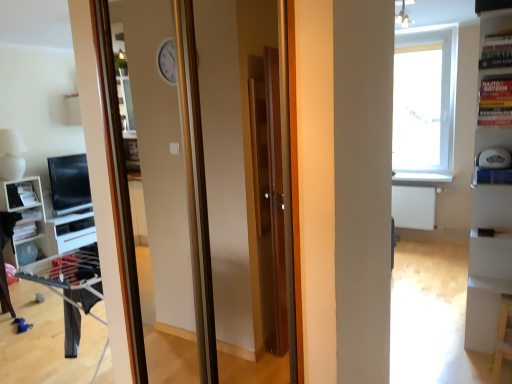
Describe the element at coordinates (488, 259) in the screenshot. The height and width of the screenshot is (384, 512). I see `white glossy bookshelf at right` at that location.

In order to face matte black monitor at left, should I rotate leftwards or rightwards?

Result: A 23.103 degree turn to the left will do.

This screenshot has width=512, height=384. What are the coordinates of `white glossy bookshelf at right` in the screenshot? It's located at (488, 259).

In terms of size, does matte black monitor at left appear bigger or smaller than white glossy shelf at left?

Considering their sizes, matte black monitor at left takes up less space than white glossy shelf at left.

Could you tell me if matte black monitor at left is facing white glossy shelf at left?

No.

Considering the points (55, 213) and (42, 196), which point is behind, point (55, 213) or point (42, 196)?

The point (42, 196) is farther.

Consider the image. Does matte black monitor at left have a lesser height compared to white glossy shelf at left?

Indeed, matte black monitor at left has a lesser height compared to white glossy shelf at left.

Is matte black monitor at left shorter than white glossy bookshelf at right?

Indeed, matte black monitor at left has a lesser height compared to white glossy bookshelf at right.

Can you confirm if matte black monitor at left is bigger than white glossy bookshelf at right?

Actually, matte black monitor at left might be smaller than white glossy bookshelf at right.

From the image's perspective, would you say matte black monitor at left is positioned over white glossy bookshelf at right?

Incorrect, from the image's perspective, matte black monitor at left is lower than white glossy bookshelf at right.

Does transparent glass window at upper right have a smaller size compared to white glossy bookshelf at right?

Yes.

How many degrees apart are the facing directions of transparent glass window at upper right and white glossy bookshelf at right?

The facing directions of transparent glass window at upper right and white glossy bookshelf at right are 89.7 degrees apart.

Is transparent glass window at upper right closer to camera compared to white glossy bookshelf at right?

No, transparent glass window at upper right is behind white glossy bookshelf at right.

From the image's perspective, is transparent glass window at upper right above or below white glossy bookshelf at right?

transparent glass window at upper right is situated higher than white glossy bookshelf at right in the image.

How different are the orientations of transparent glass window at upper right and white glossy shelf at left in degrees?

transparent glass window at upper right and white glossy shelf at left are facing 89.6 degrees away from each other.

Does transparent glass window at upper right have a lesser height compared to white glossy shelf at left?

In fact, transparent glass window at upper right may be taller than white glossy shelf at left.

Is transparent glass window at upper right inside the boundaries of white glossy shelf at left, or outside?

transparent glass window at upper right lies outside white glossy shelf at left.

Measure the distance between transparent glass window at upper right and white glossy shelf at left.

transparent glass window at upper right and white glossy shelf at left are 4.72 meters apart.

In terms of size, does white glossy bookshelf at right appear bigger or smaller than white glossy shelf at left?

Considering their sizes, white glossy bookshelf at right takes up more space than white glossy shelf at left.

Would you say white glossy bookshelf at right is outside white glossy shelf at left?

Absolutely, white glossy bookshelf at right is external to white glossy shelf at left.

What's the angular difference between white glossy bookshelf at right and white glossy shelf at left's facing directions?

They differ by 179 degrees in their facing directions.

Which is behind, point (503, 33) or point (20, 257)?

Positioned behind is point (20, 257).

Is white glossy bookshelf at right taller or shorter than matte black monitor at left?

white glossy bookshelf at right is taller than matte black monitor at left.

Based on their sizes in the image, would you say white glossy bookshelf at right is bigger or smaller than matte black monitor at left?

Considering their sizes, white glossy bookshelf at right takes up more space than matte black monitor at left.

Between white glossy bookshelf at right and matte black monitor at left, which one appears on the left side from the viewer's perspective?

Positioned to the left is matte black monitor at left.

Looking at this image, in terms of width, does white glossy bookshelf at right look wider or thinner when compared to matte black monitor at left?

Clearly, white glossy bookshelf at right has more width compared to matte black monitor at left.

Is white glossy shelf at left thinner than transparent glass window at upper right?

No.

Is white glossy shelf at left behind transparent glass window at upper right?

No, it is not.

Is white glossy shelf at left to the left of transparent glass window at upper right from the viewer's perspective?

Yes, white glossy shelf at left is to the left of transparent glass window at upper right.

This screenshot has width=512, height=384. Identify the location of computer monitor above the white glossy shelf at left (from the image's perspective). (69, 184).

You are a GUI agent. You are given a task and a screenshot of the screen. Output one action in this format:
    pyautogui.click(x=<x>, y=<y>)
    Task: Click on the computer monitor below the white glossy bookshelf at right (from the image's perspective)
    Image resolution: width=512 pixels, height=384 pixels.
    Given the screenshot: What is the action you would take?
    pyautogui.click(x=69, y=184)

Considering their positions, is transparent glass window at upper right positioned closer to white glossy shelf at left than white glossy bookshelf at right?

white glossy bookshelf at right.

Looking at the image, which one is located further to white glossy bookshelf at right, transparent glass window at upper right or white glossy shelf at left?

white glossy shelf at left is positioned further to the anchor white glossy bookshelf at right.

Considering their positions, is matte black monitor at left positioned closer to transparent glass window at upper right than white glossy bookshelf at right?

Based on the image, white glossy bookshelf at right appears to be nearer to transparent glass window at upper right.

Looking at the image, which one is located further to matte black monitor at left, white glossy shelf at left or transparent glass window at upper right?

transparent glass window at upper right is positioned further to the anchor matte black monitor at left.

Estimate the real-world distances between objects in this image. Which object is closer to white glossy shelf at left, matte black monitor at left or transparent glass window at upper right?

matte black monitor at left.

When comparing their distances from matte black monitor at left, does white glossy bookshelf at right or transparent glass window at upper right seem closer?

white glossy bookshelf at right lies closer to matte black monitor at left than the other object.

From the image, which object appears to be farther from white glossy shelf at left, transparent glass window at upper right or matte black monitor at left?

transparent glass window at upper right.

Looking at the image, which one is located further to transparent glass window at upper right, matte black monitor at left or white glossy shelf at left?

white glossy shelf at left is positioned further to the anchor transparent glass window at upper right.

Identify the location of computer monitor located between white glossy shelf at left and white glossy bookshelf at right in the left-right direction. This screenshot has height=384, width=512. (69, 184).

At what (x,y) coordinates should I click in order to perform the action: click on window situated between white glossy shelf at left and white glossy bookshelf at right from left to right. Please return your answer as a coordinate pair (x, y). The width and height of the screenshot is (512, 384). Looking at the image, I should click on (424, 105).

At what (x,y) coordinates should I click in order to perform the action: click on computer monitor situated between white glossy shelf at left and transparent glass window at upper right from left to right. Please return your answer as a coordinate pair (x, y). The width and height of the screenshot is (512, 384). Looking at the image, I should click on (69, 184).

Where is `window between matte black monitor at left and white glossy bookshelf at right`? This screenshot has height=384, width=512. window between matte black monitor at left and white glossy bookshelf at right is located at coordinates (424, 105).